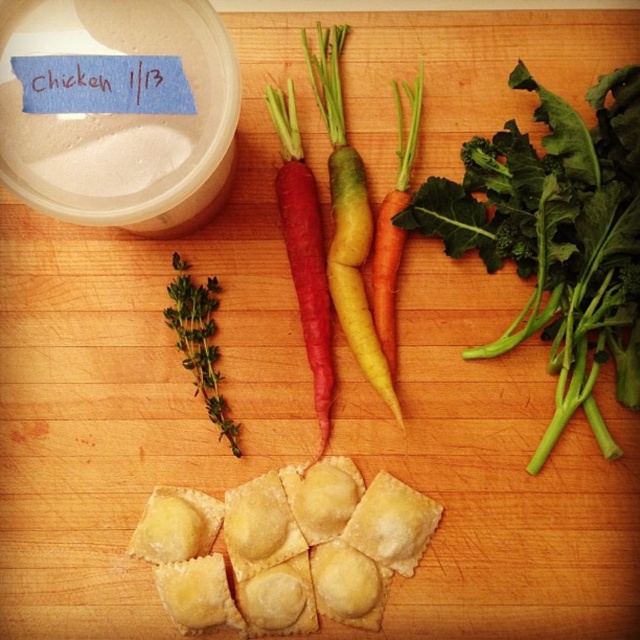
Is yellow matte carrot at center above red matte carrot at center?

Yes, yellow matte carrot at center is above red matte carrot at center.

Is point (333, 120) farther from camera compared to point (280, 180)?

No, (333, 120) is closer to viewer.

You are a GUI agent. You are given a task and a screenshot of the screen. Output one action in this format:
    pyautogui.click(x=<x>, y=<y>)
    Task: Click on the yellow matte carrot at center
    
    Given the screenshot: What is the action you would take?
    (x=348, y=216)

Does golden doughy ravioli at center have a lesser width compared to green herb at center?

No, golden doughy ravioli at center is not thinner than green herb at center.

Who is higher up, golden doughy ravioli at center or green herb at center?

green herb at center is higher up.

Where is `golden doughy ravioli at center`? The width and height of the screenshot is (640, 640). golden doughy ravioli at center is located at coordinates (285, 547).

Image resolution: width=640 pixels, height=640 pixels. What are the coordinates of `golden doughy ravioli at center` in the screenshot? It's located at (285, 547).

Who is more distant from viewer, (320,84) or (397,269)?

Point (397,269)

Which is more to the right, yellow matte carrot at center or orange matte carrot at center?

orange matte carrot at center

Locate an element on the screen. The height and width of the screenshot is (640, 640). yellow matte carrot at center is located at coordinates (348, 216).